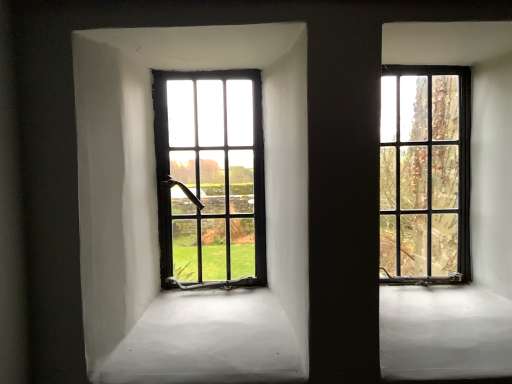
What is the approximate width of matte black window at right, the 1th window positioned from the right?

It is 3.54 inches.

This screenshot has width=512, height=384. Find the location of `matte black window at right, the 1th window positioned from the right`. matte black window at right, the 1th window positioned from the right is located at coordinates (425, 174).

What do you see at coordinates (425, 174) in the screenshot? The image size is (512, 384). I see `matte black window at right, the 1th window positioned from the right` at bounding box center [425, 174].

Measure the distance between point (422, 251) and camera.

Point (422, 251) is 3.96 feet from camera.

What is the approximate width of matte black window at center left, the first window when ordered from left to right?

It is 3.28 inches.

Measure the distance between matte black window at center left, which is counted as the second window, starting from the right, and camera.

matte black window at center left, which is counted as the second window, starting from the right, and camera are 3.76 feet apart from each other.

Identify the location of matte black window at center left, the first window when ordered from left to right. This screenshot has width=512, height=384. (210, 178).

What do you see at coordinates (210, 178) in the screenshot?
I see `matte black window at center left, the first window when ordered from left to right` at bounding box center [210, 178].

Identify the location of matte black window at right, the 1th window positioned from the right. (425, 174).

Between matte black window at right, the 1th window positioned from the right, and matte black window at center left, which is counted as the second window, starting from the right, which one appears on the right side from the viewer's perspective?

matte black window at right, the 1th window positioned from the right, is more to the right.

Between matte black window at right, the 2th window viewed from the left, and matte black window at center left, which is counted as the second window, starting from the right, which one is positioned behind?

matte black window at center left, which is counted as the second window, starting from the right, is further away from the camera.

Is point (400, 281) closer to viewer compared to point (175, 236)?

Yes, point (400, 281) is closer to viewer.

From the image's perspective, relative to matte black window at center left, the first window when ordered from left to right, is matte black window at right, the 2th window viewed from the left, above or below?

Based on their image positions, matte black window at right, the 2th window viewed from the left, is located above matte black window at center left, the first window when ordered from left to right.

From a real-world perspective, is matte black window at right, the 2th window viewed from the left, positioned above or below matte black window at center left, which is counted as the second window, starting from the right?

Clearly, from a real-world perspective, matte black window at right, the 2th window viewed from the left, is above matte black window at center left, which is counted as the second window, starting from the right.

Between matte black window at right, the 2th window viewed from the left, and matte black window at center left, the first window when ordered from left to right, which one has smaller width?

matte black window at center left, the first window when ordered from left to right.

Can you confirm if matte black window at right, the 2th window viewed from the left, is taller than matte black window at center left, which is counted as the second window, starting from the right?

Indeed, matte black window at right, the 2th window viewed from the left, has a greater height compared to matte black window at center left, which is counted as the second window, starting from the right.

Considering the relative sizes of matte black window at right, the 1th window positioned from the right, and matte black window at center left, the first window when ordered from left to right, in the image provided, is matte black window at right, the 1th window positioned from the right, smaller than matte black window at center left, the first window when ordered from left to right,?

Yes, matte black window at right, the 1th window positioned from the right, is smaller than matte black window at center left, the first window when ordered from left to right.

Is matte black window at right, the 1th window positioned from the right, positioned beyond the bounds of matte black window at center left, which is counted as the second window, starting from the right?

Absolutely, matte black window at right, the 1th window positioned from the right, is external to matte black window at center left, which is counted as the second window, starting from the right.

Is matte black window at right, the 2th window viewed from the left, touching matte black window at center left, the first window when ordered from left to right?

No, matte black window at right, the 2th window viewed from the left, is not with matte black window at center left, the first window when ordered from left to right.

Looking at this image, is matte black window at right, the 2th window viewed from the left, positioned with its back to matte black window at center left, the first window when ordered from left to right?

No, matte black window at right, the 2th window viewed from the left, is not facing away from matte black window at center left, the first window when ordered from left to right.

How different are the orientations of matte black window at right, the 2th window viewed from the left, and matte black window at center left, the first window when ordered from left to right, in degrees?

The angle between the facing direction of matte black window at right, the 2th window viewed from the left, and the facing direction of matte black window at center left, the first window when ordered from left to right, is 0.805 degrees.

Identify the location of window located in front of the matte black window at center left, the first window when ordered from left to right. pyautogui.click(x=425, y=174).

Based on the photo, which is more to the right, matte black window at center left, the first window when ordered from left to right, or matte black window at right, the 2th window viewed from the left?

Positioned to the right is matte black window at right, the 2th window viewed from the left.

Which object is closer to the camera, matte black window at center left, which is counted as the second window, starting from the right, or matte black window at right, the 2th window viewed from the left?

matte black window at right, the 2th window viewed from the left, is more forward.

Does point (254, 266) lie behind point (460, 82)?

Yes.

In the scene shown: From the image's perspective, who appears lower, matte black window at center left, the first window when ordered from left to right, or matte black window at right, the 2th window viewed from the left?

matte black window at center left, the first window when ordered from left to right.

From a real-world perspective, is matte black window at center left, the first window when ordered from left to right, beneath matte black window at right, the 2th window viewed from the left?

Yes, from a real-world perspective, matte black window at center left, the first window when ordered from left to right, is beneath matte black window at right, the 2th window viewed from the left.

Which of these two, matte black window at center left, which is counted as the second window, starting from the right, or matte black window at right, the 2th window viewed from the left, is thinner?

Thinner between the two is matte black window at center left, which is counted as the second window, starting from the right.

Between matte black window at center left, the first window when ordered from left to right, and matte black window at right, the 2th window viewed from the left, which one has more height?

Standing taller between the two is matte black window at right, the 2th window viewed from the left.

Considering the sizes of matte black window at center left, the first window when ordered from left to right, and matte black window at right, the 2th window viewed from the left, in the image, is matte black window at center left, the first window when ordered from left to right, bigger or smaller than matte black window at right, the 2th window viewed from the left,?

In the image, matte black window at center left, the first window when ordered from left to right, appears to be larger than matte black window at right, the 2th window viewed from the left.

Would you say matte black window at center left, which is counted as the second window, starting from the right, is outside matte black window at right, the 1th window positioned from the right?

Yes, matte black window at center left, which is counted as the second window, starting from the right, is not within matte black window at right, the 1th window positioned from the right.

Is matte black window at center left, the first window when ordered from left to right, not close to matte black window at right, the 2th window viewed from the left?

No, matte black window at center left, the first window when ordered from left to right, is not far away from matte black window at right, the 2th window viewed from the left.

Is matte black window at center left, which is counted as the second window, starting from the right, oriented away from matte black window at right, the 1th window positioned from the right?

matte black window at center left, which is counted as the second window, starting from the right, is not turned away from matte black window at right, the 1th window positioned from the right.

How many degrees apart are the facing directions of matte black window at center left, which is counted as the second window, starting from the right, and matte black window at right, the 2th window viewed from the left?

They differ by 0.805 degrees in their facing directions.

Could you measure the distance between matte black window at center left, which is counted as the second window, starting from the right, and matte black window at right, the 1th window positioned from the right?

matte black window at center left, which is counted as the second window, starting from the right, and matte black window at right, the 1th window positioned from the right, are 49.33 centimeters apart from each other.

The width and height of the screenshot is (512, 384). What are the coordinates of `window located on the left of matte black window at right, the 2th window viewed from the left` in the screenshot? It's located at (210, 178).

The image size is (512, 384). In the image, there is a matte black window at center left, the first window when ordered from left to right. Find the location of `window above it (from the image's perspective)`. window above it (from the image's perspective) is located at coordinates (425, 174).

At what (x,y) coordinates should I click in order to perform the action: click on window that is on the left side of matte black window at right, the 1th window positioned from the right. Please return your answer as a coordinate pair (x, y). The height and width of the screenshot is (384, 512). Looking at the image, I should click on (210, 178).